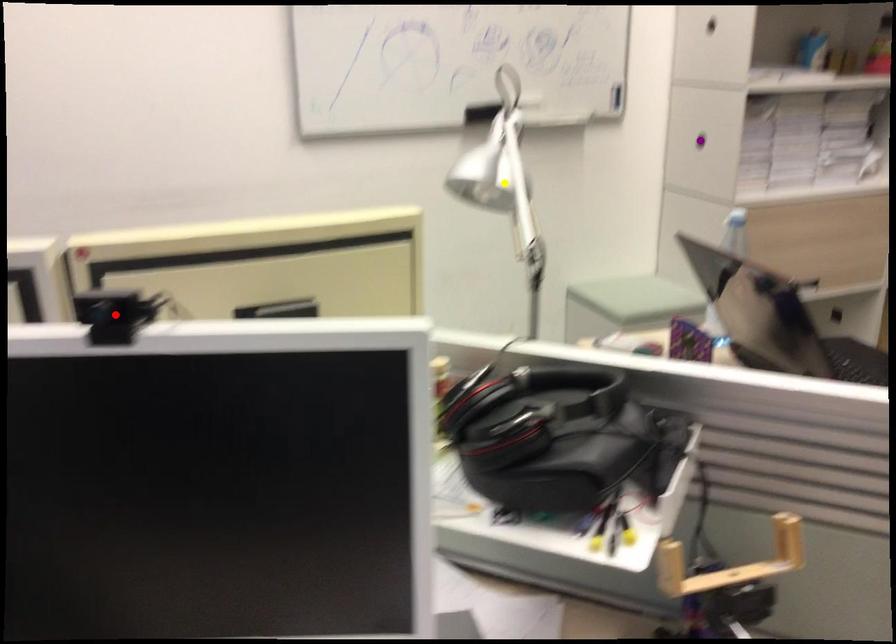
Order these from nearest to farthest:
- purple point
- yellow point
- red point

red point < yellow point < purple point